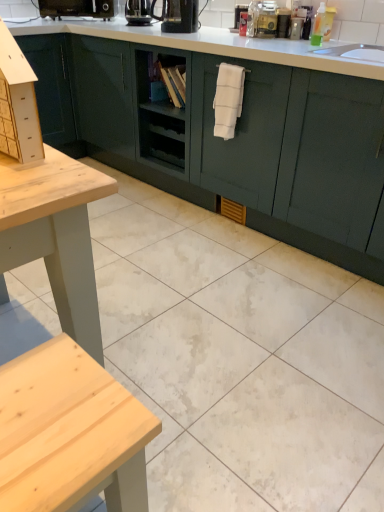
Image resolution: width=384 pixels, height=512 pixels. Find the location of `vacant area in front of translucent plastic bottle at upper center`. vacant area in front of translucent plastic bottle at upper center is located at coordinates (266, 40).